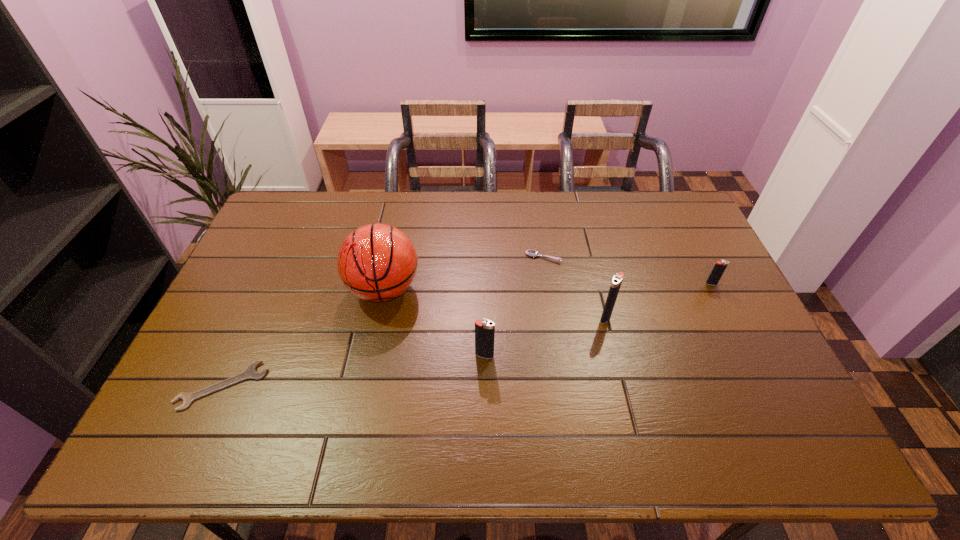
Image resolution: width=960 pixels, height=540 pixels. In order to click on blank region between the second igniter from right to left and the soupspoon in this screenshot , I will do `click(575, 287)`.

Find the location of a particular element. vacant area that lies between the farthest igniter and the fifth farthest object is located at coordinates (598, 320).

This screenshot has width=960, height=540. In order to click on free space between the shortest object and the leftmost igniter in this screenshot , I will do `click(353, 370)`.

Where is `vacant space in between the wrench and the second shortest object`? The image size is (960, 540). vacant space in between the wrench and the second shortest object is located at coordinates (383, 322).

You are a GUI agent. You are given a task and a screenshot of the screen. Output one action in this format:
    pyautogui.click(x=<x>, y=<y>)
    Task: Click on the free space between the soupspoon and the second farthest igniter
    
    Given the screenshot: What is the action you would take?
    (x=575, y=287)

You are a GUI agent. You are given a task and a screenshot of the screen. Output one action in this format:
    pyautogui.click(x=<x>, y=<y>)
    Task: Click on the vacant region between the fourth object from left to right and the leftmost igniter
    The height and width of the screenshot is (540, 960).
    Given the screenshot: What is the action you would take?
    pyautogui.click(x=514, y=306)

At what (x,y) coordinates should I click in order to perform the action: click on free spot between the wrench and the third object from right to left. Please return your answer as a coordinate pair (x, y). The height and width of the screenshot is (540, 960). Looking at the image, I should click on pos(383,322).

You are a GUI agent. You are given a task and a screenshot of the screen. Output one action in this format:
    pyautogui.click(x=<x>, y=<y>)
    Task: Click on the free space between the tallest object and the farthest object
    The image size is (960, 540).
    Given the screenshot: What is the action you would take?
    pyautogui.click(x=464, y=273)

Locate which object is the second closest to the fifth object from left to right. Please provide its 2D coordinates. Your answer should be formatted as a tuple, i.e. [(x, y)], where the tuple contains the x and y coordinates of a point satisfying the conditions above.

[(484, 330)]

The image size is (960, 540). I want to click on object that is the second closest to the leftmost object, so click(484, 330).